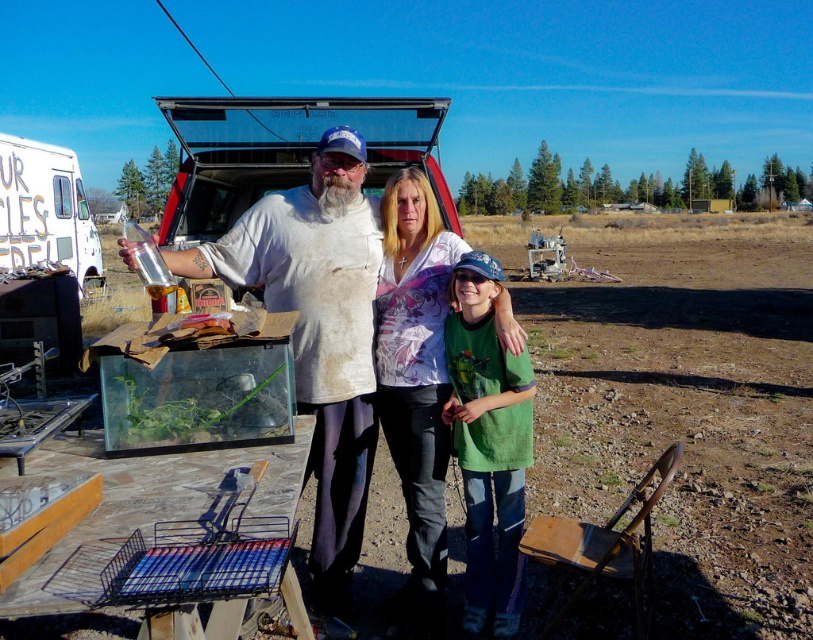
Question: Considering the relative positions of worn white shirt at center and green cotton shirt at center in the image provided, where is worn white shirt at center located with respect to green cotton shirt at center?

Choices:
 (A) above
 (B) below

Answer: (A)

Question: Considering the real-world distances, which object is farthest from the green cotton shirt at center?

Choices:
 (A) worn white shirt at center
 (B) matte white blouse at center

Answer: (A)

Question: Can you confirm if matte white blouse at center is smaller than green cotton shirt at center?

Choices:
 (A) no
 (B) yes

Answer: (B)

Question: Which point is closer to the camera taking this photo?

Choices:
 (A) (474, 520)
 (B) (429, 548)

Answer: (B)

Question: Which point appears farthest from the camera in this image?

Choices:
 (A) (459, 376)
 (B) (341, 513)

Answer: (B)

Question: Can you confirm if worn white shirt at center is positioned to the left of green cotton shirt at center?

Choices:
 (A) yes
 (B) no

Answer: (A)